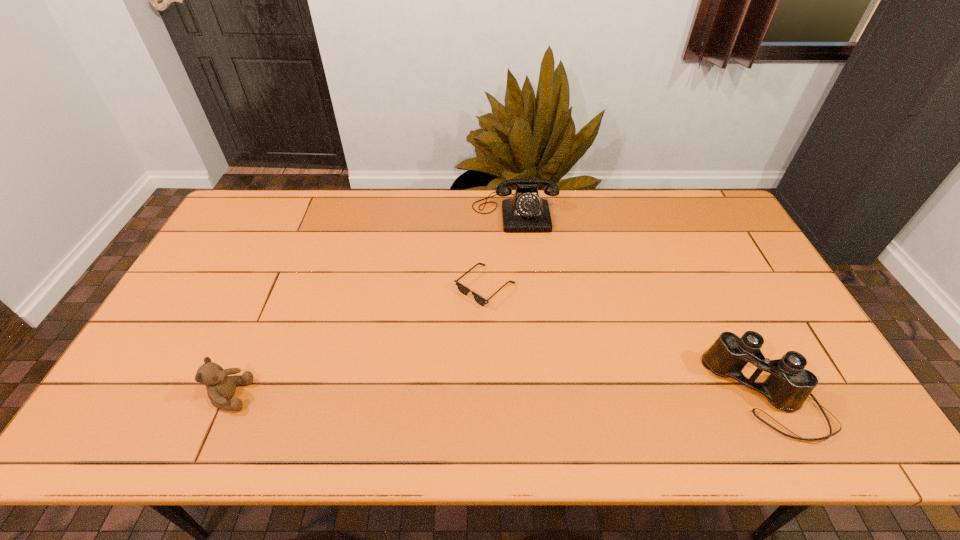
Locate an element on the screen. vacant space located 0.150m on the front face of the telephone is located at coordinates (520, 264).

Where is `vacant region located 0.340m on the front face of the telephone`? This screenshot has height=540, width=960. vacant region located 0.340m on the front face of the telephone is located at coordinates (524, 310).

The width and height of the screenshot is (960, 540). Find the location of `blank space located on the front face of the telephone`. blank space located on the front face of the telephone is located at coordinates (521, 282).

You are a GUI agent. You are given a task and a screenshot of the screen. Output one action in this format:
    pyautogui.click(x=<x>, y=<y>)
    Task: Click on the object located in the far edge section of the desktop
    
    Given the screenshot: What is the action you would take?
    pyautogui.click(x=525, y=212)

Find the location of a particular element. This screenshot has height=540, width=960. teddy bear located at the near edge is located at coordinates (220, 387).

In order to click on binoculars at the near edge in this screenshot , I will do `click(788, 386)`.

This screenshot has width=960, height=540. Find the location of `object at the right edge`. object at the right edge is located at coordinates (788, 386).

Find the location of `object that is at the near right corner`. object that is at the near right corner is located at coordinates (788, 386).

In the image, there is a desktop. Find the location of `vacant space at the far edge`. vacant space at the far edge is located at coordinates [341, 216].

The image size is (960, 540). I want to click on free region at the near edge of the desktop, so click(x=466, y=388).